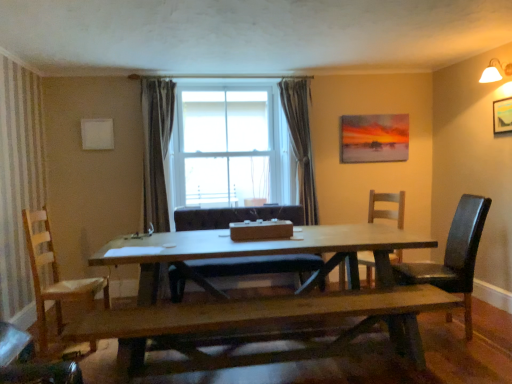
Where is `vacant space underneath wooden bench at center (from a real-world perspective)`? This screenshot has width=512, height=384. vacant space underneath wooden bench at center (from a real-world perspective) is located at coordinates (297, 370).